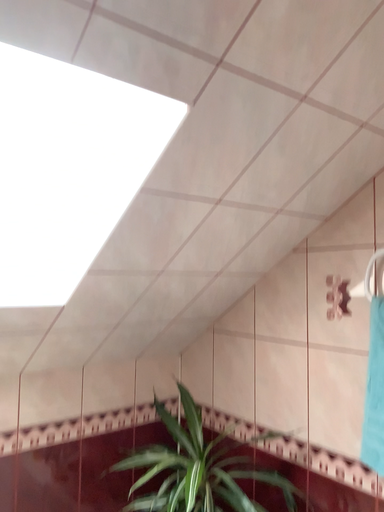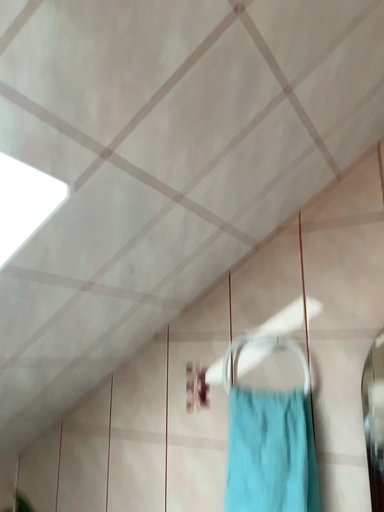
Question: Which way did the camera rotate in the video?

Choices:
 (A) rotated left
 (B) rotated right

Answer: (B)